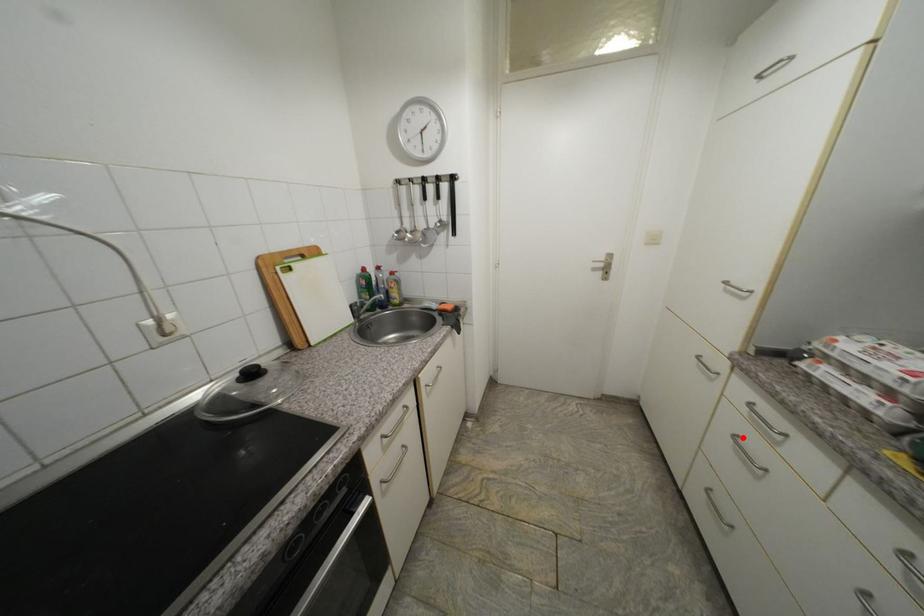
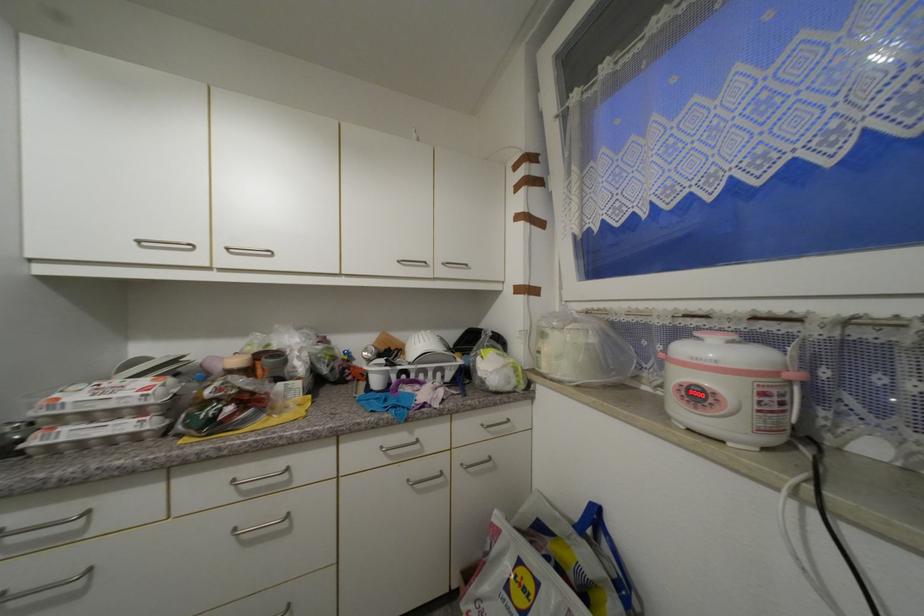
Where in the second image is the point corresponding to the highlighted location from the first image?

(6, 597)